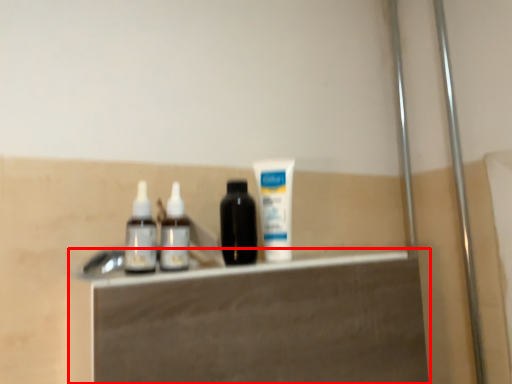
Question: From the image's perspective, what is the correct spatial relationship of vanity (annotated by the red box) in relation to toothpaste?

Choices:
 (A) above
 (B) below

Answer: (B)